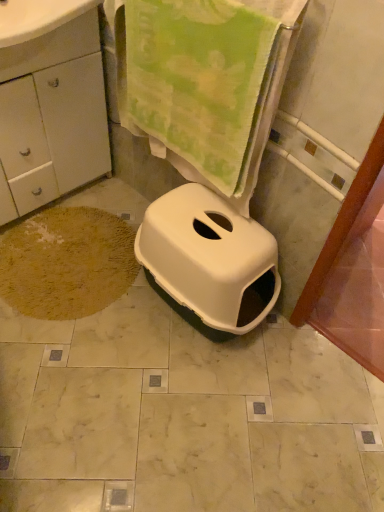
Question: Can we say brown shaggy rug at lower left lies outside white plastic litter box at center?

Choices:
 (A) no
 (B) yes

Answer: (B)

Question: From the image's perspective, is brown shaggy rug at lower left below white plastic litter box at center?

Choices:
 (A) no
 (B) yes

Answer: (A)

Question: From a real-world perspective, is brown shaggy rug at lower left located beneath white plastic litter box at center?

Choices:
 (A) yes
 (B) no

Answer: (A)

Question: Considering the relative positions of brown shaggy rug at lower left and white plastic litter box at center in the image provided, is brown shaggy rug at lower left to the right of white plastic litter box at center from the viewer's perspective?

Choices:
 (A) yes
 (B) no

Answer: (B)

Question: Considering the relative sizes of brown shaggy rug at lower left and white plastic litter box at center in the image provided, is brown shaggy rug at lower left bigger than white plastic litter box at center?

Choices:
 (A) yes
 (B) no

Answer: (B)

Question: Considering the relative positions of brown shaggy rug at lower left and white plastic litter box at center in the image provided, is brown shaggy rug at lower left in front of white plastic litter box at center?

Choices:
 (A) yes
 (B) no

Answer: (B)

Question: From a real-world perspective, is white matte cabinet at lower left physically above white plastic litter box at center?

Choices:
 (A) yes
 (B) no

Answer: (A)

Question: Would you say white matte cabinet at lower left is outside white plastic litter box at center?

Choices:
 (A) no
 (B) yes

Answer: (B)

Question: From the image's perspective, would you say white matte cabinet at lower left is shown under white plastic litter box at center?

Choices:
 (A) no
 (B) yes

Answer: (A)

Question: Considering the relative sizes of white matte cabinet at lower left and white plastic litter box at center in the image provided, is white matte cabinet at lower left thinner than white plastic litter box at center?

Choices:
 (A) yes
 (B) no

Answer: (A)

Question: Does white matte cabinet at lower left have a lesser height compared to white plastic litter box at center?

Choices:
 (A) no
 (B) yes

Answer: (A)

Question: Is white plastic litter box at center located within white matte cabinet at lower left?

Choices:
 (A) yes
 (B) no

Answer: (B)

Question: Can you confirm if white matte cabinet at lower left is smaller than green plush towel at upper center?

Choices:
 (A) no
 (B) yes

Answer: (A)